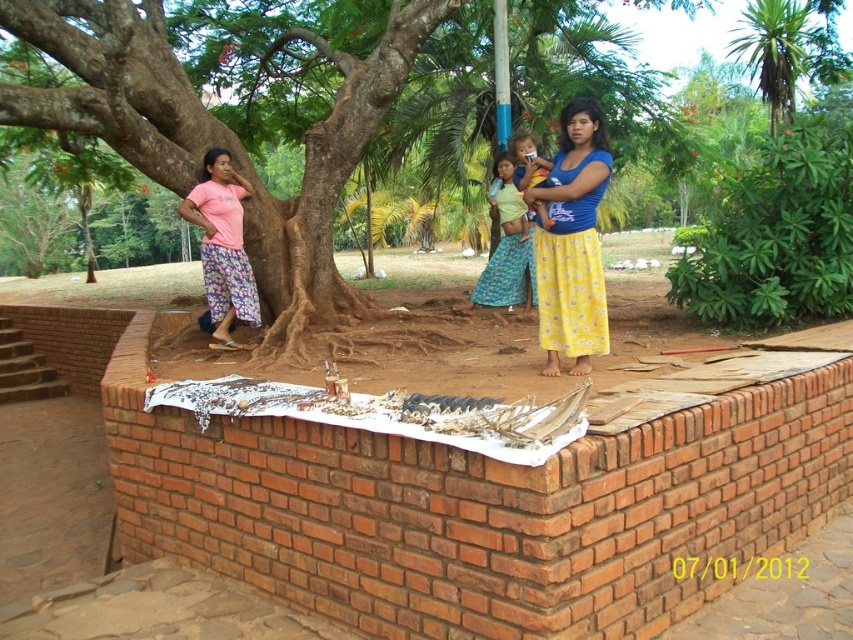
Question: Which of the following is the farthest from the observer?

Choices:
 (A) brown rough tree at upper left
 (B) yellow fabric baby at center

Answer: (B)

Question: Which is farther from the blue/yellow floral skirt at center?

Choices:
 (A) brown rough tree at upper left
 (B) yellow fabric at center
 (C) pink fabric pants at left

Answer: (B)

Question: Does brown rough tree at upper left have a smaller size compared to blue/yellow floral skirt at center?

Choices:
 (A) yes
 (B) no

Answer: (B)

Question: Is yellow fabric baby at center closer to the viewer compared to yellow fabric at center?

Choices:
 (A) yes
 (B) no

Answer: (A)

Question: Is pink fabric pants at left to the left of yellow fabric at center from the viewer's perspective?

Choices:
 (A) no
 (B) yes

Answer: (B)

Question: Which of the following is the farthest from the observer?

Choices:
 (A) yellow fabric at center
 (B) pink fabric pants at left
 (C) yellow fabric baby at center

Answer: (A)